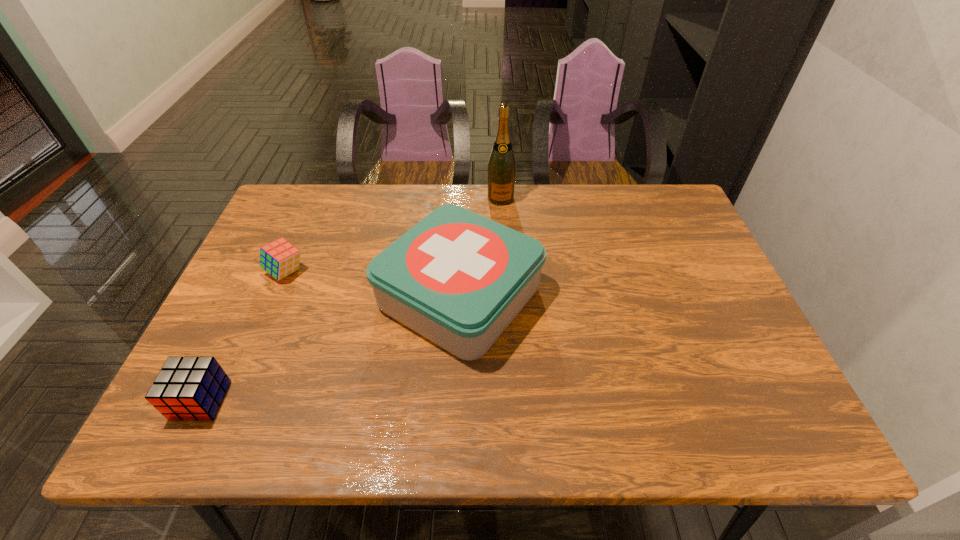
I want to click on object present at the near edge, so click(x=191, y=388).

Where is `object that is positioned at the near left corner`? The width and height of the screenshot is (960, 540). object that is positioned at the near left corner is located at coordinates (191, 388).

The width and height of the screenshot is (960, 540). In the image, there is a desktop. Identify the location of free space at the far edge. (578, 211).

Find the location of a particular element. This screenshot has height=540, width=960. vacant area at the near edge is located at coordinates (713, 438).

Where is `blank space at the left edge of the desktop`? This screenshot has height=540, width=960. blank space at the left edge of the desktop is located at coordinates (295, 245).

At what (x,y) coordinates should I click in order to perform the action: click on vacant space at the right edge of the desktop. Please return your answer as a coordinate pair (x, y). The height and width of the screenshot is (540, 960). Looking at the image, I should click on (682, 242).

Image resolution: width=960 pixels, height=540 pixels. I want to click on free region at the far right corner of the desktop, so click(x=645, y=221).

In the image, there is a desktop. Identify the location of vacant region at the near right corner. The height and width of the screenshot is (540, 960). (775, 420).

The height and width of the screenshot is (540, 960). What are the coordinates of `empty location between the first-aid kit and the nearest object` in the screenshot? It's located at (330, 348).

I want to click on free space between the farther cube and the farthest object, so click(394, 235).